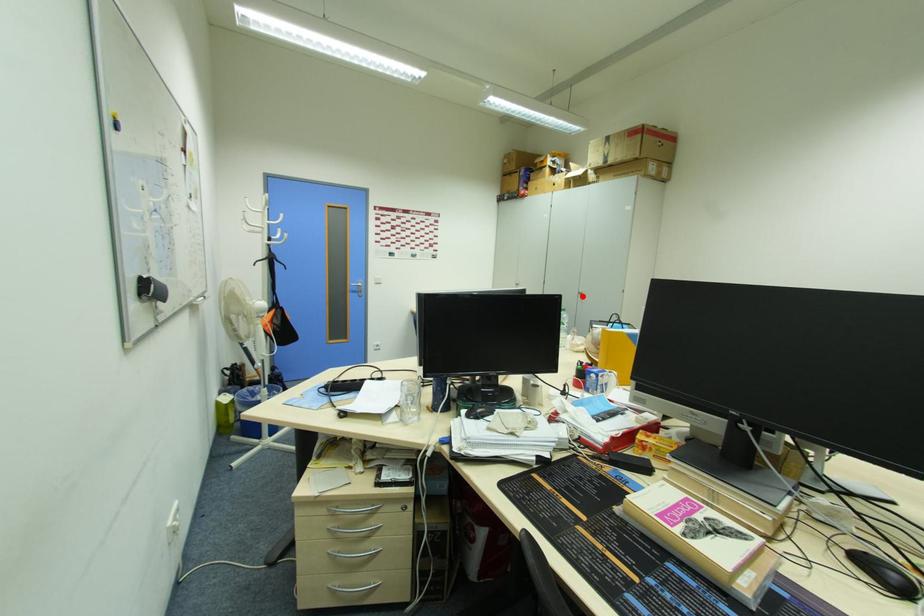
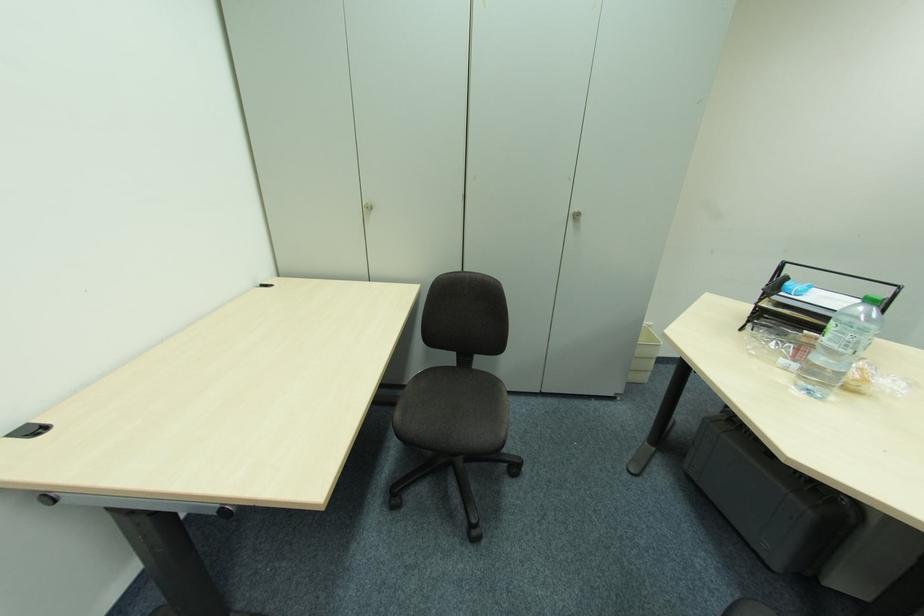
Where in the second image is the point corresponding to the highlighted location from the first image?

(574, 219)